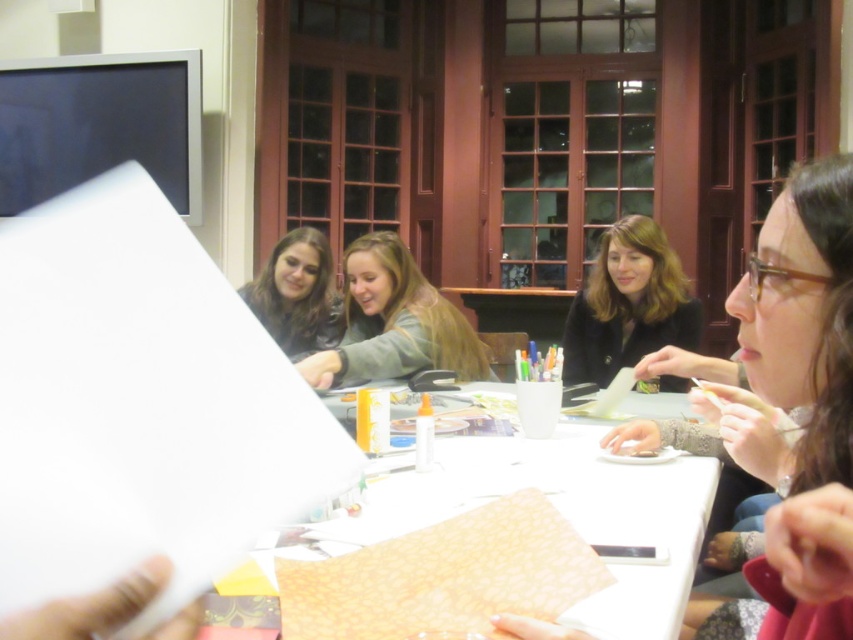
Question: Is white paper at center smaller than smooth beige sweater at center?

Choices:
 (A) yes
 (B) no

Answer: (A)

Question: Does white paper at center come in front of black matte jacket at center?

Choices:
 (A) yes
 (B) no

Answer: (A)

Question: Which point appears closest to the camera in this image?

Choices:
 (A) (271, 282)
 (B) (643, 266)

Answer: (B)

Question: Which of the following is the farthest from the observer?

Choices:
 (A) (625, 323)
 (B) (252, 285)
 (C) (474, 442)
 (D) (848, 572)

Answer: (B)

Question: Based on their relative distances, which object is nearer to the matte brown hair at center?

Choices:
 (A) black matte jacket at center
 (B) white paper at center
 (C) smooth beige sweater at center
 (D) matte black jacket at center

Answer: (C)

Question: Does white paper at center appear on the right side of black matte jacket at center?

Choices:
 (A) no
 (B) yes

Answer: (A)